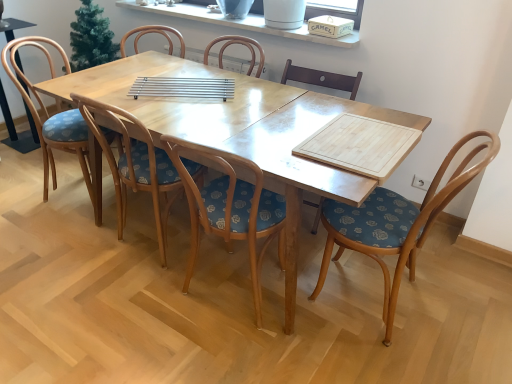
Locate an element on the screen. This screenshot has height=384, width=512. free space in front of wooden chair at left is located at coordinates (19, 158).